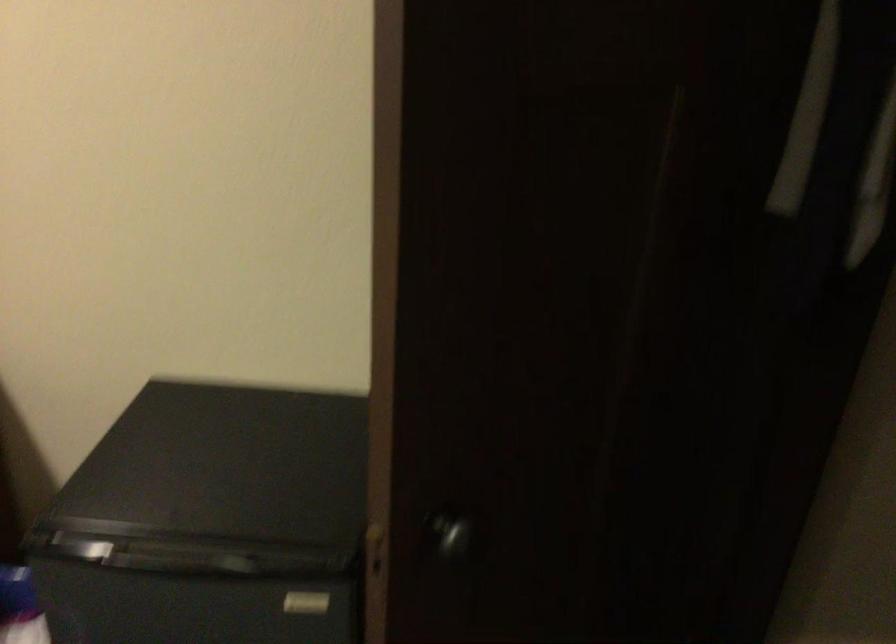
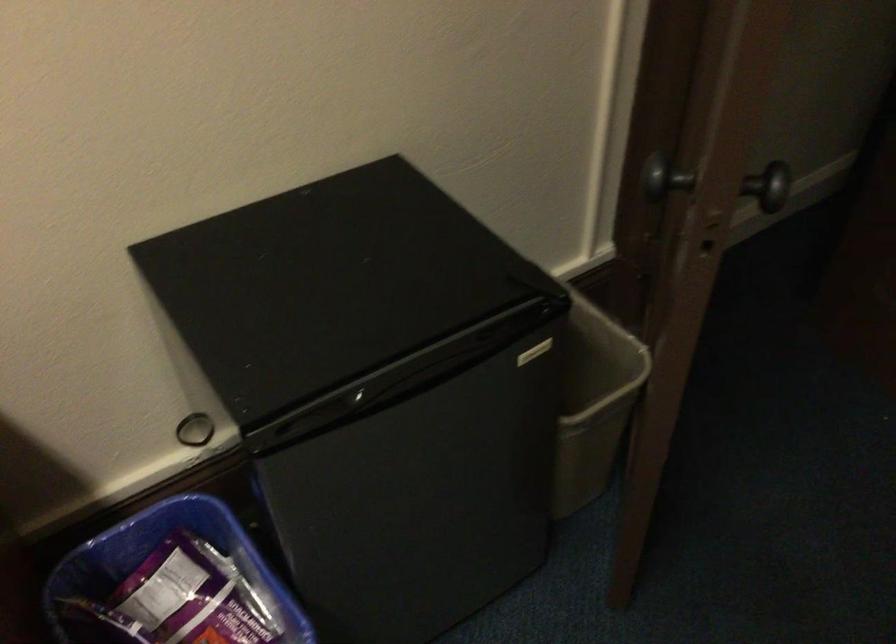
In the second image, find the point that corresponds to the point at 467,529 in the first image.

(771, 185)